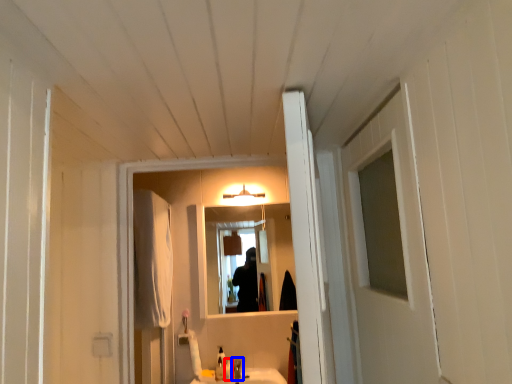
Question: Which point is further to the camera, toiletry (highlighted by a red box) or faucet (highlighted by a blue box)?

Choices:
 (A) toiletry
 (B) faucet

Answer: (A)